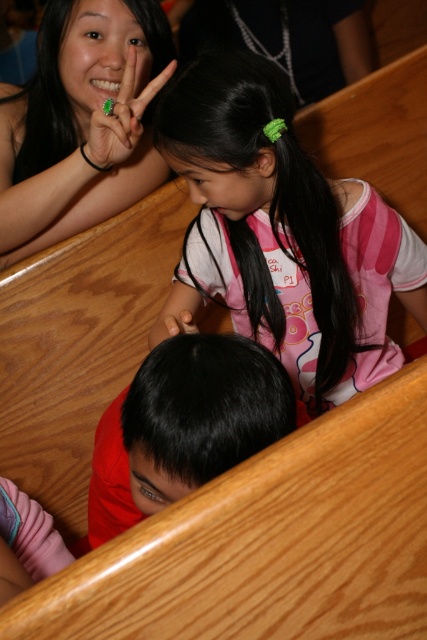
You are standing in the church and want to take a photo of the scene. The camera you are using has a 100mm lens. The matte black hand at upper left is in your frame at coordinates point 0.192, 0.192. To ensure the hand is centered in the photo, what adjustment should you make to the camera?

To center the matte black hand at upper left, which is at point [81,122], you should move the camera upwards and to the left so the hand is positioned at the center coordinates of the frame.

You are standing at the point labeled as point (94, 184) and want to move towards the point labeled as point (351, 304). According to the image, will you be moving forward or backward?

Since point (351, 304) is in front of point (94, 184), moving towards it would mean moving forward.